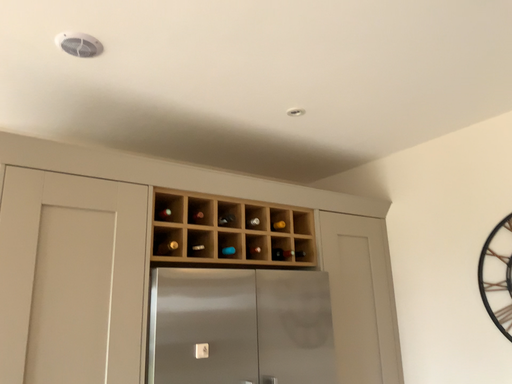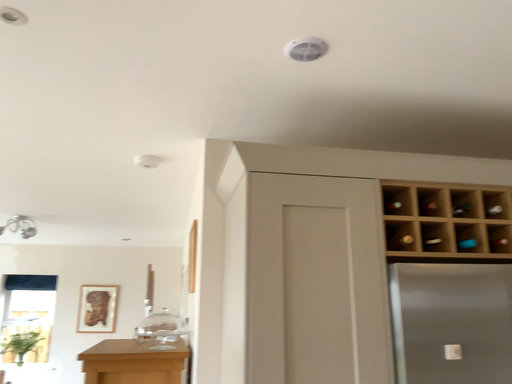
Question: How did the camera likely rotate when shooting the video?

Choices:
 (A) rotated left
 (B) rotated right

Answer: (A)